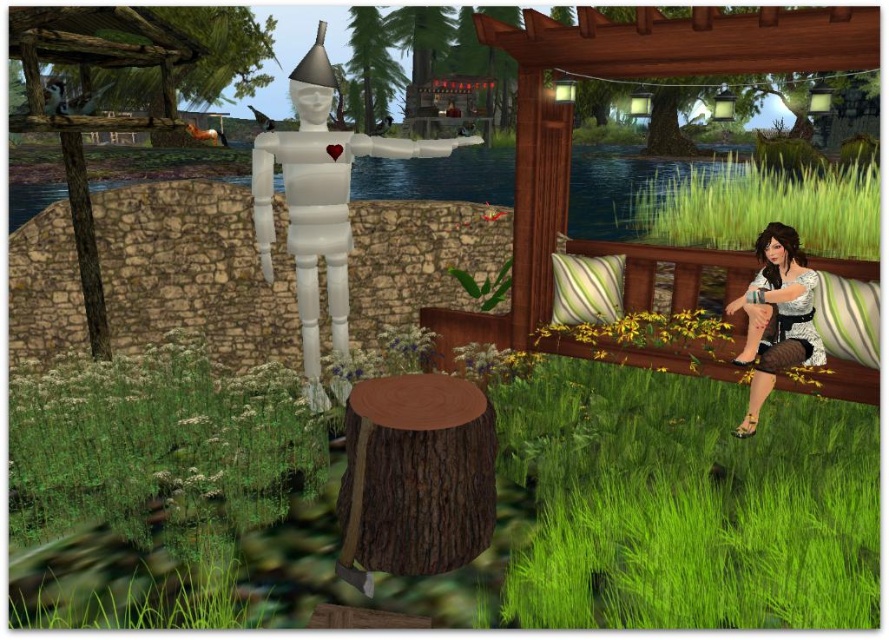
Which is behind, point (374, 477) or point (767, 344)?

Positioned behind is point (767, 344).

From the picture: Who is positioned more to the right, brown wood stump at center or white lace dress at right?

Positioned to the right is white lace dress at right.

Looking at this image, who is more forward, (487, 426) or (777, 280)?

Point (487, 426) is in front.

Find the location of `brown wood stump at center`. brown wood stump at center is located at coordinates (417, 474).

Does point (292, 147) lie behind point (743, 200)?

No, it is not.

Locate an element on the screen. transparent plastic figure at center is located at coordinates (319, 200).

Does brown wood stump at center appear on the right side of green grass at upper center?

No, brown wood stump at center is not to the right of green grass at upper center.

Does brown wood stump at center have a greater height compared to green grass at upper center?

In fact, brown wood stump at center may be shorter than green grass at upper center.

Does point (351, 497) come behind point (703, 182)?

No, it is not.

The image size is (889, 640). Find the location of `brown wood stump at center`. brown wood stump at center is located at coordinates (417, 474).